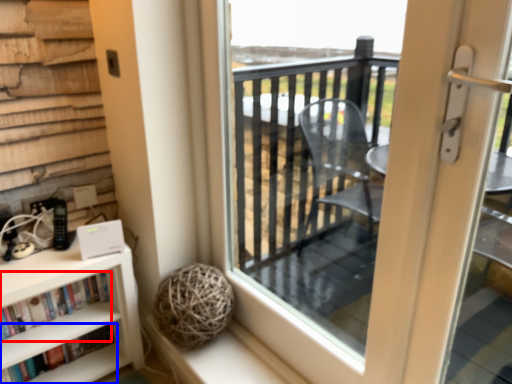
Question: Among these objects, which one is farthest to the camera, book (highlighted by a red box) or book (highlighted by a blue box)?

Choices:
 (A) book
 (B) book

Answer: (B)